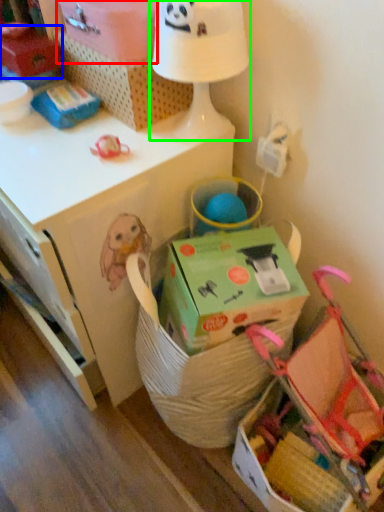
Question: Based on their relative distances, which object is nearer to cardboard box (highlighted by a red box)? Choose from storage box (highlighted by a blue box) and table lamp (highlighted by a green box).

Choices:
 (A) storage box
 (B) table lamp

Answer: (B)